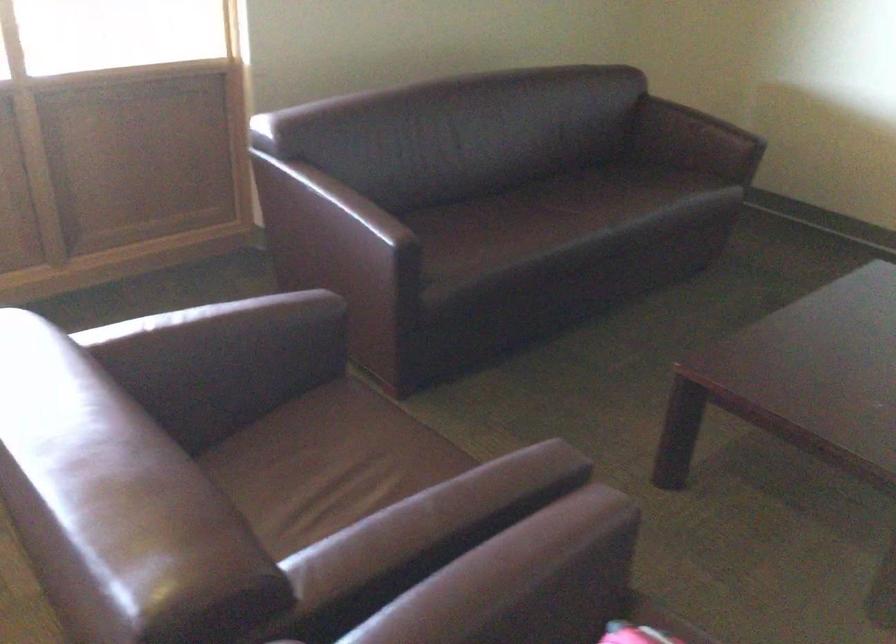
The width and height of the screenshot is (896, 644). Describe the element at coordinates (547, 223) in the screenshot. I see `a sofa sitting surface` at that location.